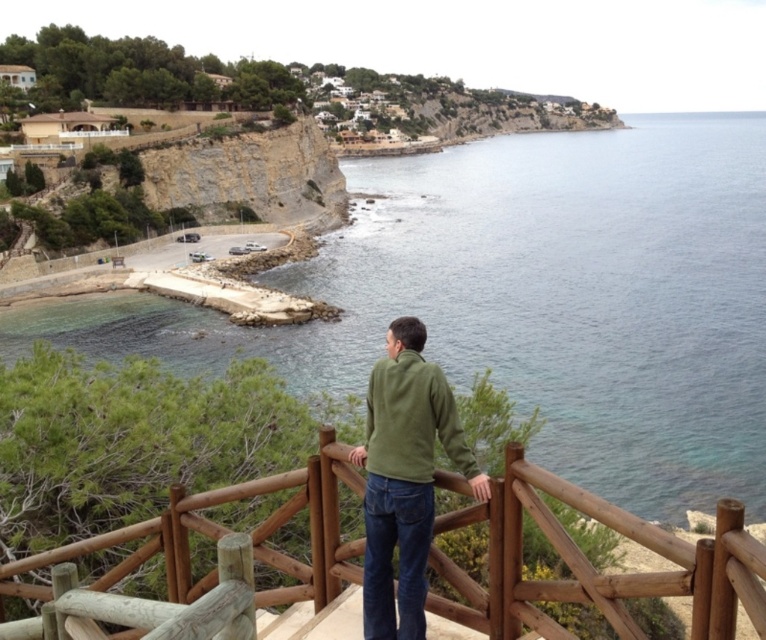
You are standing on a cliff overlooking the ocean and see a man wearing two green items at the center. Which one is closer to you, the green fleece jacket at center or the green fleece sweatshirt at center?

The green fleece jacket at center is closer to the viewer than the green fleece sweatshirt at center.

Based on the photo, you are standing on a cliff overlooking the ocean and see a wooden at center and a green fleece jacket at center. Which object is closer to the edge of the cliff?

The wooden at center is positioned under the green fleece jacket at center, so the wooden at center is closer to the edge of the cliff.